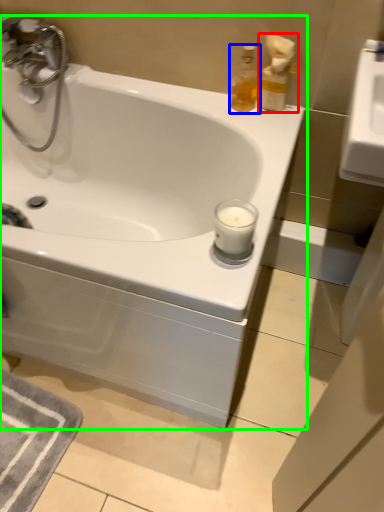
Question: Which is nearer to the soap dispenser (highlighted by a red box)? soap dispenser (highlighted by a blue box) or bathtub (highlighted by a green box).

Choices:
 (A) soap dispenser
 (B) bathtub

Answer: (A)